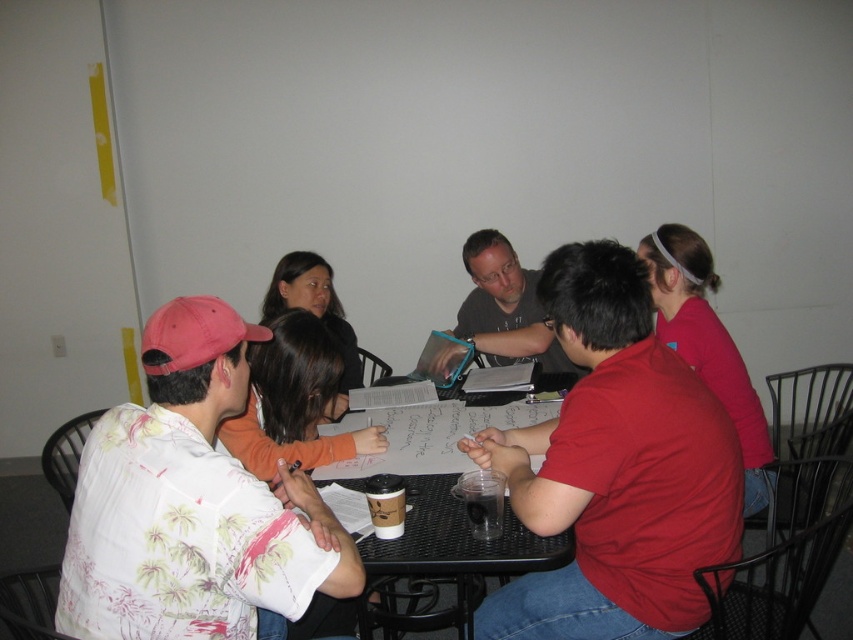
Looking at this image, you are organizing a photo shoot and need to arrange two shirts, the red matte shirt at center and the dark gray shirt at center, on a mannequin. Which shirt should you place on top to ensure visibility of both?

The red matte shirt at center is bigger than the dark gray shirt at center, so placing the red matte shirt at center on top would ensure visibility of both shirts.

You are a photographer standing at the back of the room. You want to take a photo of the white floral shirt at left and the dark gray shirt at center so that both are clearly visible. Based on their positions, which shirt should you focus on first to ensure both are in frame?

The white floral shirt at left is located below dark gray shirt at center. Therefore, to ensure both are in frame, focus on the dark gray shirt at center first as it is higher up, allowing the camera to capture the lower positioned white floral shirt at left within the same shot.

Where is the red matte shirt at center located in the image?

The red matte shirt at center is located at point coordinates of (614,468).